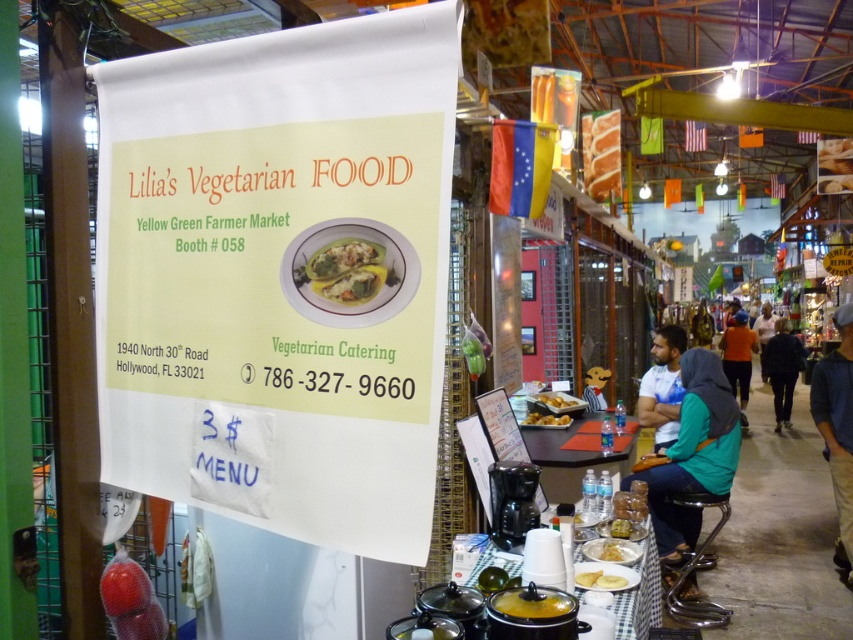
You are a photographer standing at the Yellow Green Farmer Market, aiming to capture the signboard of Lilia Food Booth. You notice two points marked on your camera screen at coordinates point (x=743, y=404) and point (x=566, y=417). Which point is closer to the camera?

Point (x=566, y=417) is closer to the camera because it is less further than point (x=743, y=404).

You are a customer at the Yellow Green Farmer Market and see the green matte vegetable at center and the orange fabric shirt at center. Which object is located above the other?

The green matte vegetable at center is positioned over orange fabric shirt at center, so the green matte vegetable at center is above the orange fabric shirt at center.

You are a customer at the Yellow Green Farmer Market and want to buy the white matte bread at lower center. However, you notice a blue denim jacket at lower right blocking your view of the bread. Can you determine which item is taller?

The blue denim jacket at lower right is taller than the white matte bread at lower center.